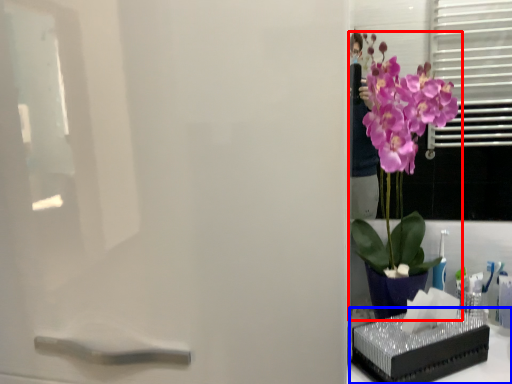
Question: Which object appears farthest to the camera in this image, houseplant (highlighted by a red box) or window sill (highlighted by a blue box)?

Choices:
 (A) houseplant
 (B) window sill

Answer: (B)